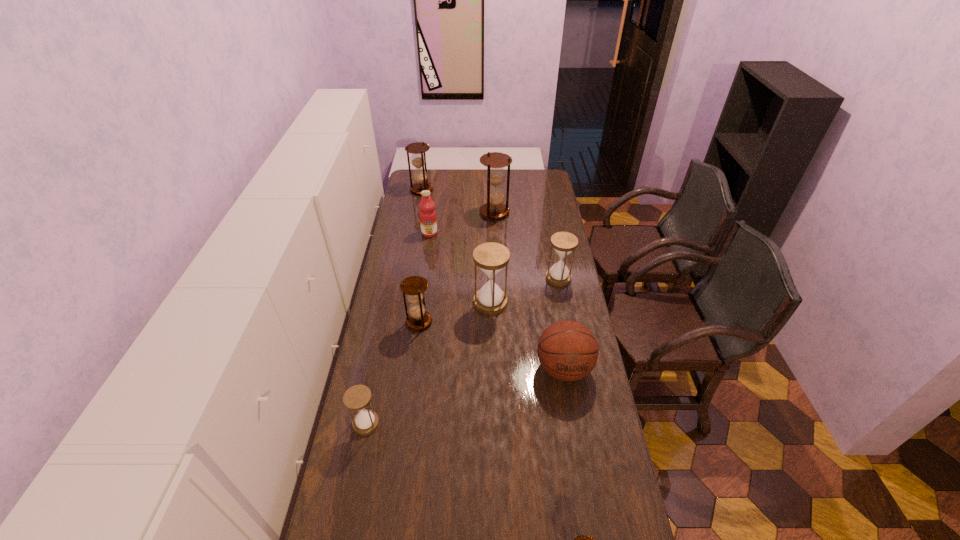
Identify which brown hourglass is the closest to the basketball. Please provide its 2D coordinates. Your answer should be formatted as a tuple, i.e. [(x, y)], where the tuple contains the x and y coordinates of a point satisfying the conditions above.

[(414, 286)]

Identify which white hourglass is the second closest to the rightmost white hourglass. Please provide its 2D coordinates. Your answer should be formatted as a tuple, i.e. [(x, y)], where the tuple contains the x and y coordinates of a point satisfying the conditions above.

[(358, 397)]

Find the location of a particular element. This screenshot has height=540, width=960. white hourglass that is the closest to the basketball is located at coordinates (491, 258).